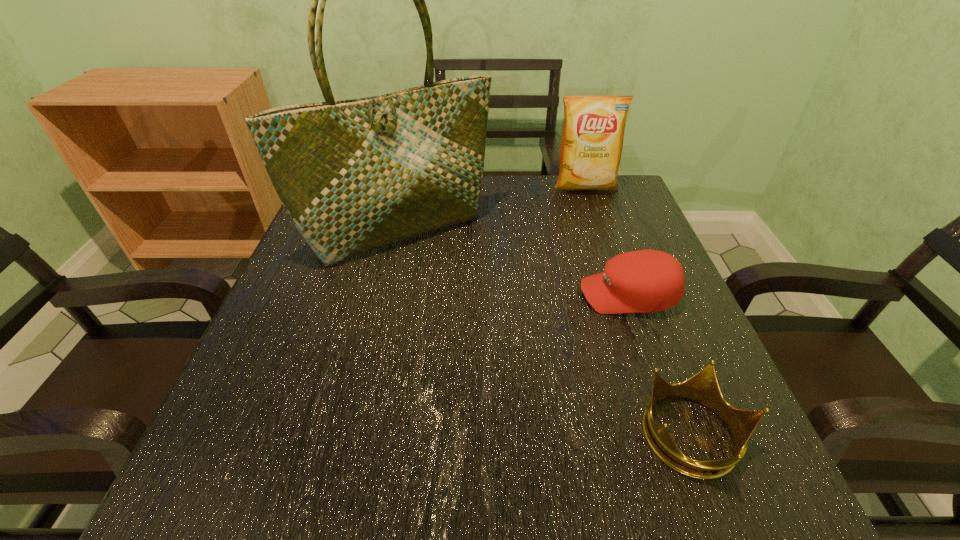
At what (x,y) coordinates should I click in order to perform the action: click on the leftmost object. Please return your answer as a coordinate pair (x, y). The image size is (960, 540). Looking at the image, I should click on (355, 175).

Where is `shopping bag`? shopping bag is located at coordinates (355, 175).

Where is `crisp (potato chip)`? The image size is (960, 540). crisp (potato chip) is located at coordinates (593, 132).

This screenshot has height=540, width=960. Identify the location of the farthest object. point(593,132).

Where is `cap`? cap is located at coordinates (644, 281).

The height and width of the screenshot is (540, 960). I want to click on the nearest object, so click(703, 387).

Identify the location of vacant space situated 0.100m on the back of the second farthest object. (412, 179).

At what (x,y) coordinates should I click in order to perform the action: click on vacant region located 0.200m on the front-facing side of the farthest object. Please return your answer as a coordinate pair (x, y). Looking at the image, I should click on (605, 242).

This screenshot has width=960, height=540. Find the location of `free space located on the front-facing side of the cap`. free space located on the front-facing side of the cap is located at coordinates (504, 295).

Image resolution: width=960 pixels, height=540 pixels. Identify the location of vacant point located 0.050m on the front-facing side of the cap. (554, 295).